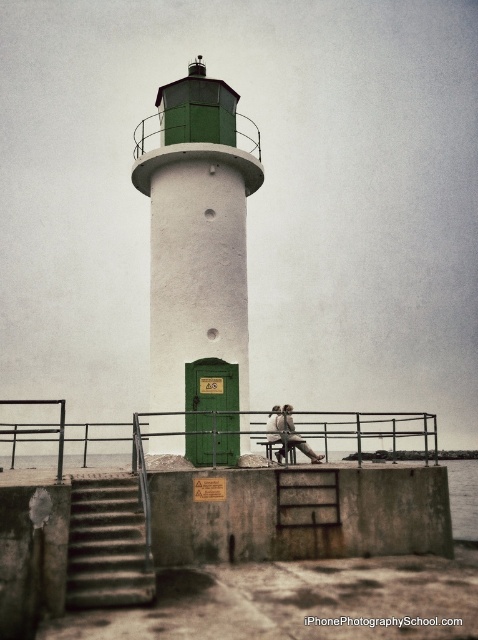
Question: Does green matte/lightweight tower at center lie behind concrete stairs at lower left?

Choices:
 (A) yes
 (B) no

Answer: (A)

Question: Which of the following is the closest to the observer?

Choices:
 (A) (204, 172)
 (B) (260, 435)
 (C) (299, 444)

Answer: (B)

Question: Which point is closer to the camera taking this photo?

Choices:
 (A) (285, 436)
 (B) (218, 259)
 (C) (82, 563)
 (D) (119, 424)

Answer: (C)

Question: Does green matte/lightweight tower at center have a larger size compared to black metal railing at lower center?

Choices:
 (A) no
 (B) yes

Answer: (A)

Question: Can you confirm if green matte/lightweight tower at center is positioned to the right of concrete stairs at lower left?

Choices:
 (A) no
 (B) yes

Answer: (B)

Question: Among these points, which one is farthest from the camera?

Choices:
 (A) (290, 412)
 (B) (246, 176)

Answer: (B)